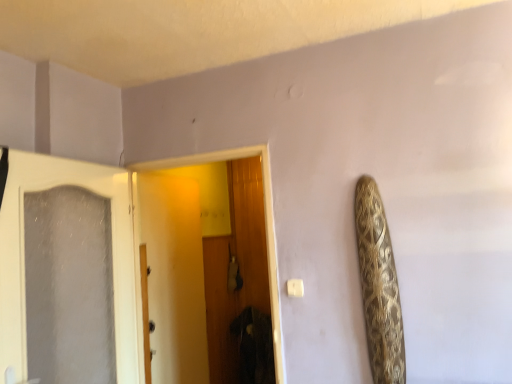
Question: From their relative heights in the image, would you say wooden door at center, positioned as the 1th door in right-to-left order, is taller or shorter than white frosted glass door at left, marked as the first door in a left-to-right arrangement?

Choices:
 (A) tall
 (B) short

Answer: (A)

Question: From a real-world perspective, is wooden door at center, positioned as the 1th door in right-to-left order, physically located above or below white frosted glass door at left, marked as the first door in a left-to-right arrangement?

Choices:
 (A) above
 (B) below

Answer: (B)

Question: Would you say wooden door at center, which is the second door from left to right, is inside or outside white frosted glass door at left, arranged as the second door when viewed from the right?

Choices:
 (A) inside
 (B) outside

Answer: (B)

Question: Which is correct: white frosted glass door at left, marked as the first door in a left-to-right arrangement, is inside wooden door at center, which is the second door from left to right, or outside of it?

Choices:
 (A) inside
 (B) outside

Answer: (B)

Question: Considering the positions of point (121, 170) and point (215, 152), is point (121, 170) closer or farther from the camera than point (215, 152)?

Choices:
 (A) farther
 (B) closer

Answer: (A)

Question: From a real-world perspective, is white frosted glass door at left, arranged as the second door when viewed from the right, above or below wooden door at center, positioned as the 1th door in right-to-left order?

Choices:
 (A) above
 (B) below

Answer: (A)

Question: Is white frosted glass door at left, arranged as the second door when viewed from the right, bigger or smaller than wooden door at center, which is the second door from left to right?

Choices:
 (A) small
 (B) big

Answer: (A)